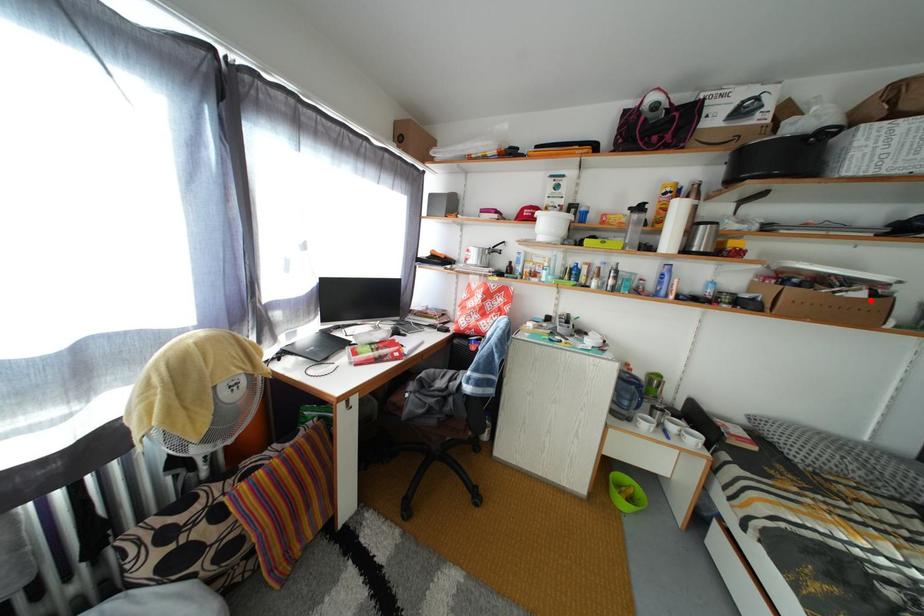
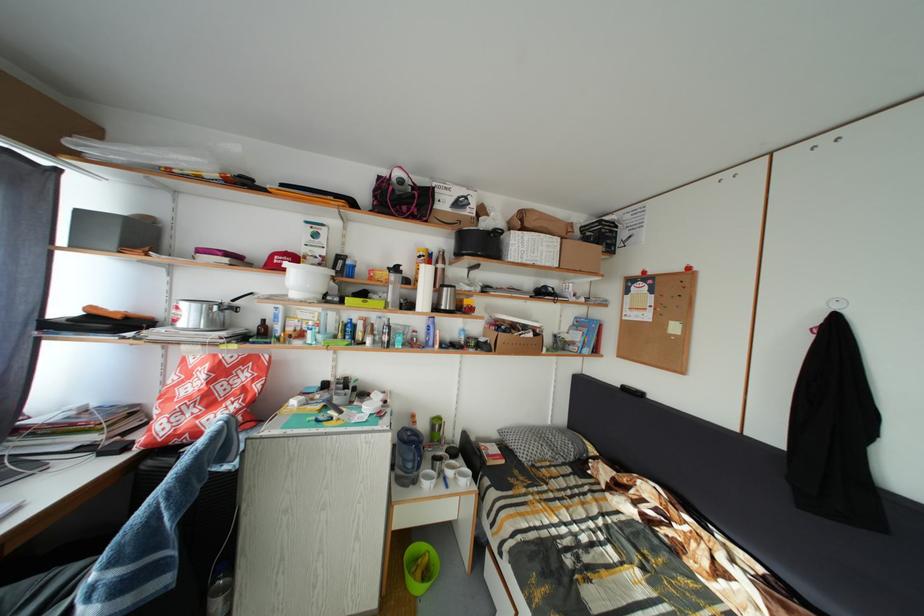
The point at the highlighted location is marked in the first image. Where is the corresponding point in the second image?

(540, 341)